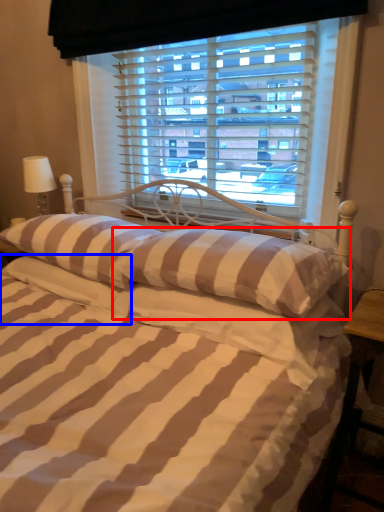
Question: Which of the following is the farthest to the observer, pillow (highlighted by a red box) or pillow (highlighted by a blue box)?

Choices:
 (A) pillow
 (B) pillow

Answer: (B)